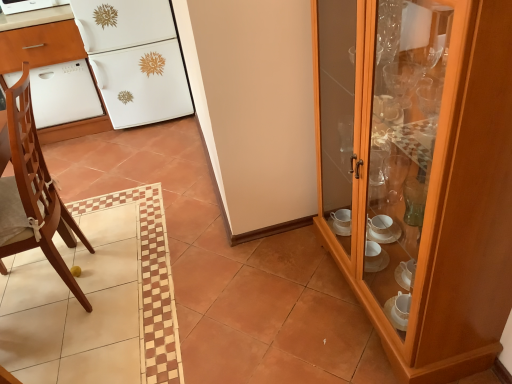
Locate an element on the screen. vacant space to the right of light brown wooden chair at left is located at coordinates (159, 278).